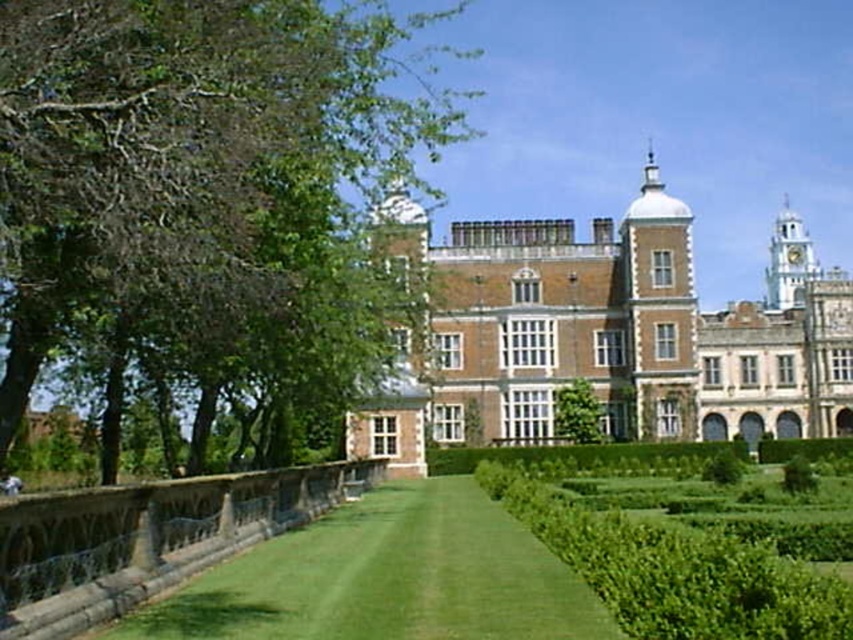
Which is below, brown brick palace at center or green leafy hedge at center?

Positioned lower is green leafy hedge at center.

Identify the location of brown brick palace at center. The width and height of the screenshot is (853, 640). (610, 336).

Which is above, brown brick palace at center or green grass at center?

Positioned higher is brown brick palace at center.

Who is positioned more to the left, brown brick palace at center or green grass at center?

From the viewer's perspective, green grass at center appears more on the left side.

Between point (496, 312) and point (234, 573), which one is positioned in front?

Positioned in front is point (234, 573).

Find the location of a particular element. brown brick palace at center is located at coordinates (610, 336).

Describe the element at coordinates (201, 186) in the screenshot. The width and height of the screenshot is (853, 640). I see `green leafy tree at upper left` at that location.

Consider the image. Which is more to the left, green leafy tree at upper left or brown brick palace at center?

green leafy tree at upper left is more to the left.

Is point (311, 60) positioned after point (515, 310)?

That is False.

I want to click on green leafy tree at upper left, so click(x=201, y=186).